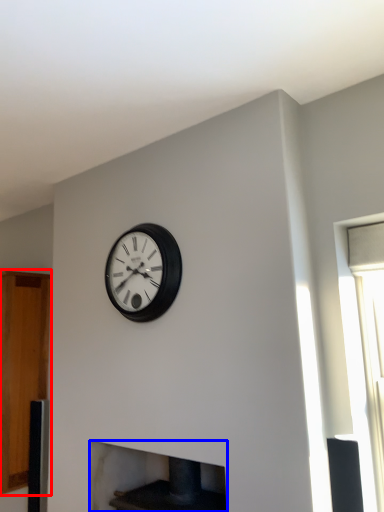
Question: Which point is closer to the camera, cabinetry (highlighted by a red box) or fireplace (highlighted by a blue box)?

Choices:
 (A) cabinetry
 (B) fireplace

Answer: (B)